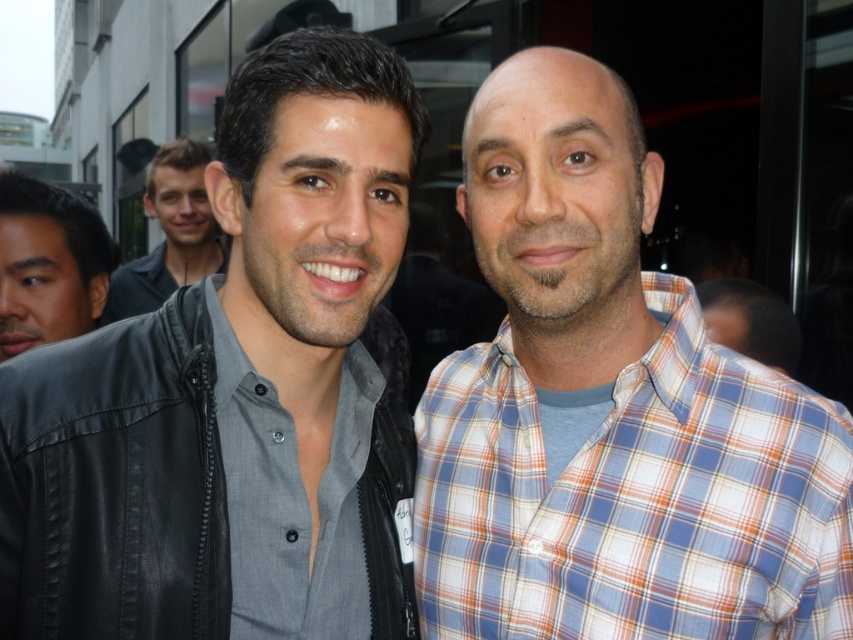
Question: Where is gray matte shirt at center located in relation to plaid shirt at right in the image?

Choices:
 (A) left
 (B) right

Answer: (A)

Question: Does blue plaid shirt at right appear on the right side of plaid shirt at right?

Choices:
 (A) yes
 (B) no

Answer: (B)

Question: Which of the following is the farthest from the observer?

Choices:
 (A) (363, 364)
 (B) (209, 253)

Answer: (B)

Question: Estimate the real-world distances between objects in this image. Which object is closer to the matte black jacket at upper left?

Choices:
 (A) matte black jacket at center
 (B) gray matte shirt at center

Answer: (A)

Question: Is gray matte shirt at center wider than matte black jacket at left?

Choices:
 (A) no
 (B) yes

Answer: (A)

Question: Among these points, which one is farthest from the camera?

Choices:
 (A) (271, 486)
 (B) (350, 348)

Answer: (B)